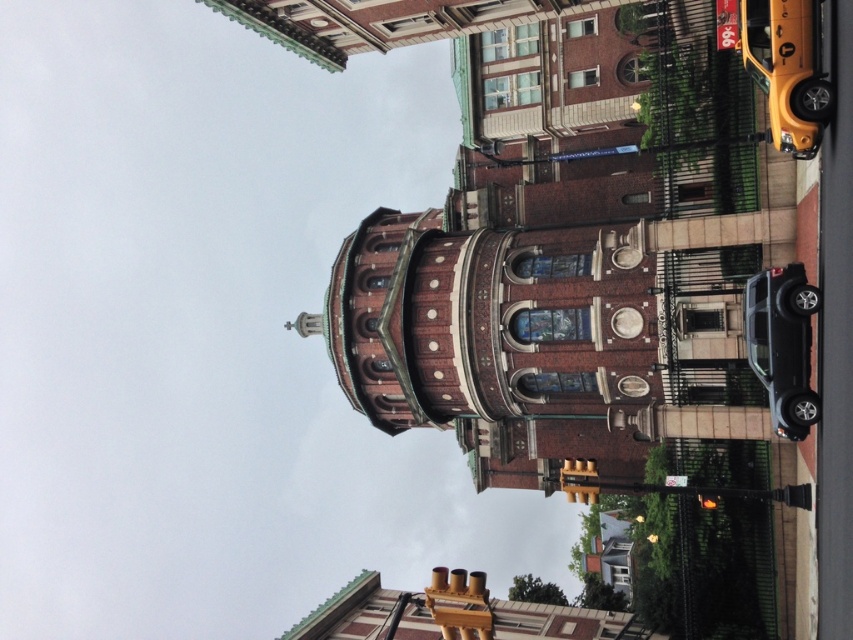
Question: Can you confirm if yellow rubber taxi at upper right is bigger than shiny black suv at lower right?

Choices:
 (A) yes
 (B) no

Answer: (A)

Question: Is yellow rubber taxi at upper right positioned in front of shiny black suv at lower right?

Choices:
 (A) yes
 (B) no

Answer: (A)

Question: Among these points, which one is nearest to the camera?

Choices:
 (A) (746, 305)
 (B) (788, 10)

Answer: (B)

Question: Which of the following is the farthest from the observer?

Choices:
 (A) yellow rubber taxi at upper right
 (B) shiny black suv at lower right

Answer: (B)

Question: Is yellow rubber taxi at upper right smaller than shiny black suv at lower right?

Choices:
 (A) yes
 (B) no

Answer: (B)